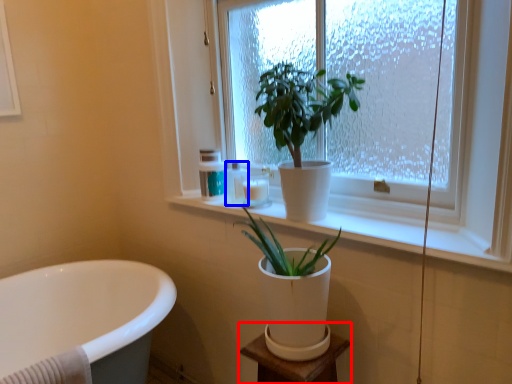
Question: Which object is further to the camera taking this photo, vanity (highlighted by a red box) or toiletry (highlighted by a blue box)?

Choices:
 (A) vanity
 (B) toiletry

Answer: (B)